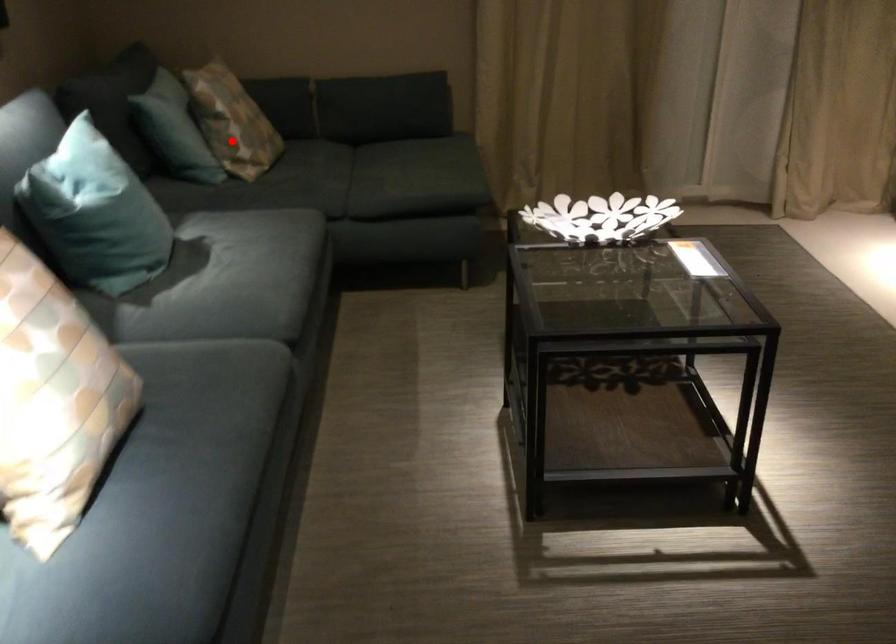
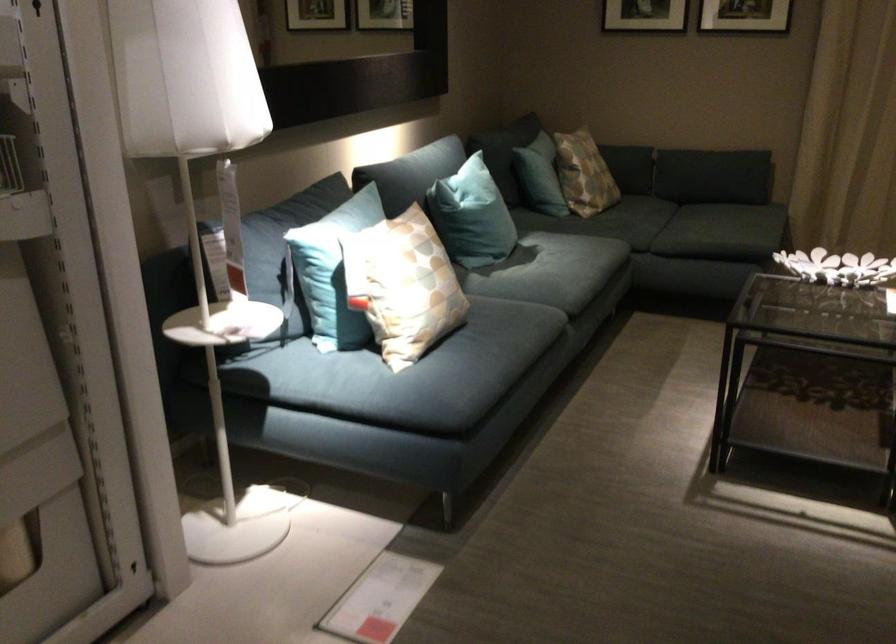
Question: A red point is marked in image1. In image2, is the corresponding 3D point closer to the camera or farther? Reply with the corresponding letter.

Choices:
 (A) The corresponding 3D point is closer.
 (B) The corresponding 3D point is farther.

Answer: (B)